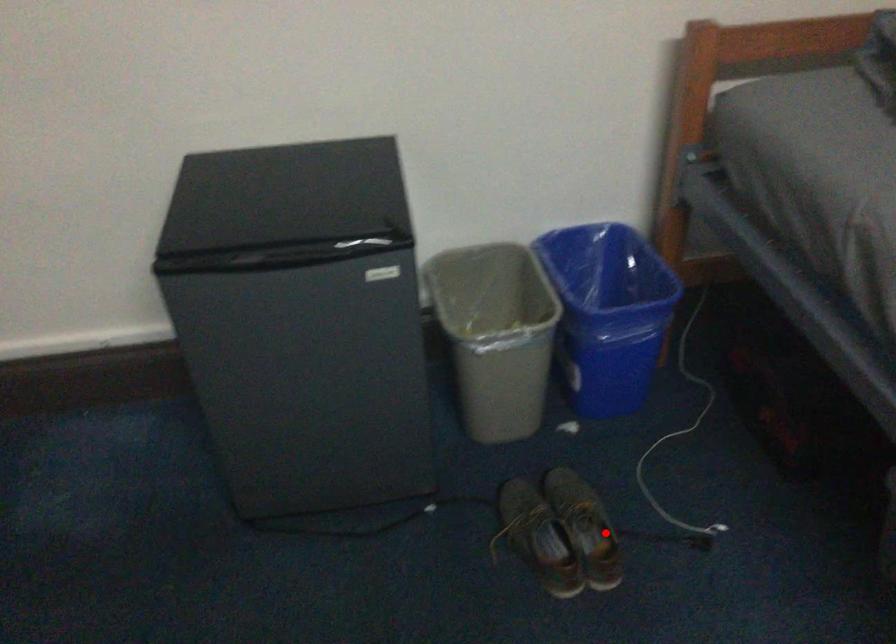
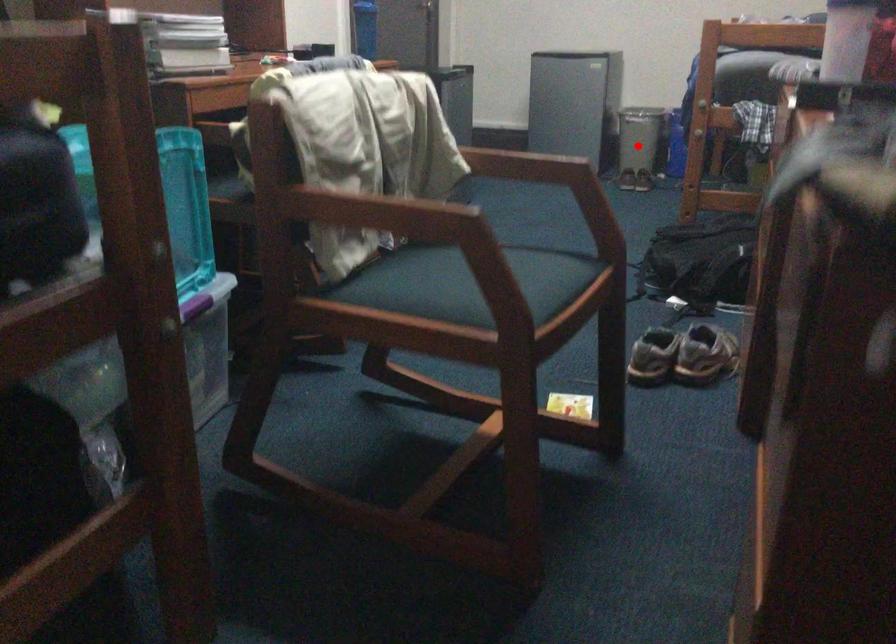
Based on the photo, I am providing you with two images of the same scene from different viewpoints. A red point is marked on the first image and another point is marked on the second image. Is the marked point in image1 the same physical position as the marked point in image2?

Yes